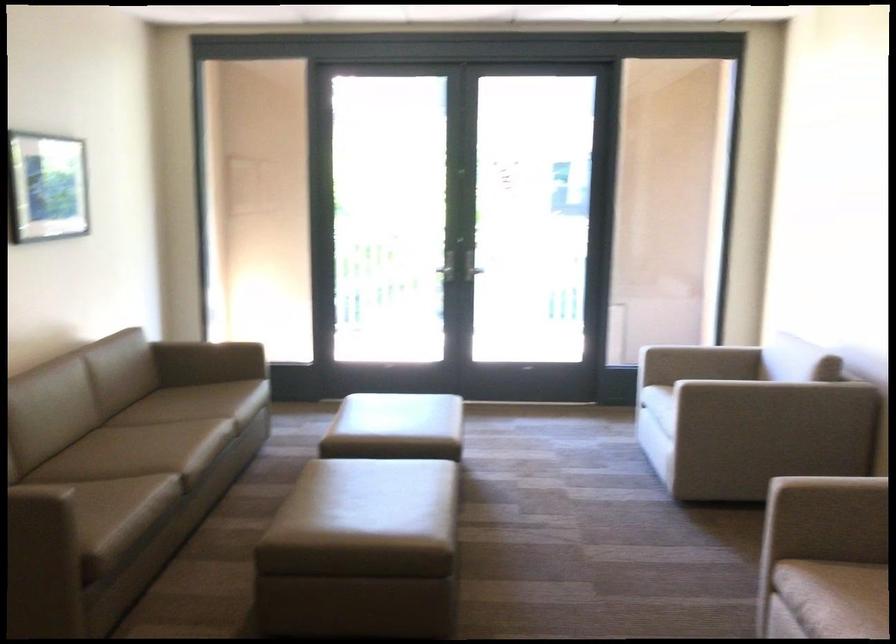
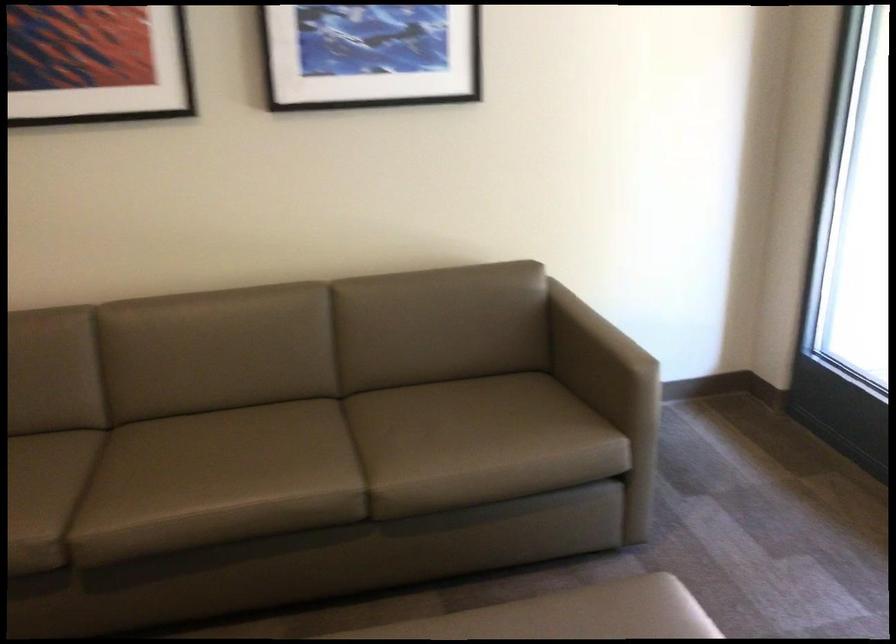
The point at (170, 418) is marked in the first image. Where is the corresponding point in the second image?

(356, 450)